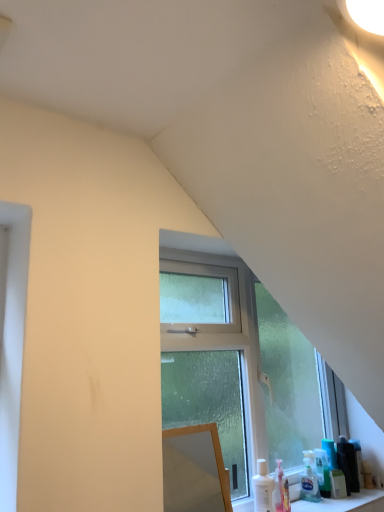
Question: Considering the relative sizes of clear glass window at center and matte black hairbrush at lower right, positioned as the 4th toiletry in left-to-right order, in the image provided, is clear glass window at center thinner than matte black hairbrush at lower right, positioned as the 4th toiletry in left-to-right order,?

Choices:
 (A) yes
 (B) no

Answer: (B)

Question: Is clear glass window at center positioned beyond the bounds of matte black hairbrush at lower right, the first toiletry viewed from the right?

Choices:
 (A) no
 (B) yes

Answer: (B)

Question: Is clear glass window at center behind matte black hairbrush at lower right, positioned as the 4th toiletry in left-to-right order?

Choices:
 (A) no
 (B) yes

Answer: (A)

Question: Does clear glass window at center have a greater width compared to matte black hairbrush at lower right, the first toiletry viewed from the right?

Choices:
 (A) no
 (B) yes

Answer: (B)

Question: Does clear glass window at center have a smaller size compared to matte black hairbrush at lower right, positioned as the 4th toiletry in left-to-right order?

Choices:
 (A) no
 (B) yes

Answer: (A)

Question: From a real-world perspective, is clear glass window at center positioned over matte black hairbrush at lower right, the first toiletry viewed from the right, based on gravity?

Choices:
 (A) no
 (B) yes

Answer: (B)

Question: Is green plastic bottle at lower right, positioned as the second toiletry in right-to-left order, bigger than clear glass window at center?

Choices:
 (A) yes
 (B) no

Answer: (B)

Question: Does green plastic bottle at lower right, which is the third toiletry from left to right, appear on the right side of clear glass window at center?

Choices:
 (A) yes
 (B) no

Answer: (A)

Question: Is green plastic bottle at lower right, positioned as the second toiletry in right-to-left order, positioned in front of clear glass window at center?

Choices:
 (A) no
 (B) yes

Answer: (A)

Question: Considering the relative sizes of green plastic bottle at lower right, positioned as the second toiletry in right-to-left order, and clear glass window at center in the image provided, is green plastic bottle at lower right, positioned as the second toiletry in right-to-left order, smaller than clear glass window at center?

Choices:
 (A) yes
 (B) no

Answer: (A)

Question: Could you tell me if green plastic bottle at lower right, which is the third toiletry from left to right, is turned towards clear glass window at center?

Choices:
 (A) no
 (B) yes

Answer: (A)

Question: Considering the relative sizes of green plastic bottle at lower right, which is the third toiletry from left to right, and clear glass window at center in the image provided, is green plastic bottle at lower right, which is the third toiletry from left to right, shorter than clear glass window at center?

Choices:
 (A) yes
 (B) no

Answer: (A)

Question: Considering the relative sizes of green plastic bottle at lower right, positioned as the second toiletry in right-to-left order, and wooden mirror at center in the image provided, is green plastic bottle at lower right, positioned as the second toiletry in right-to-left order, bigger than wooden mirror at center?

Choices:
 (A) yes
 (B) no

Answer: (B)